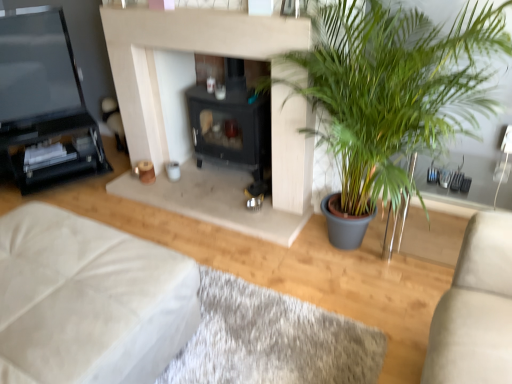
Question: Considering the relative sizes of black matte fireplace at center and green leafy plant at right in the image provided, is black matte fireplace at center shorter than green leafy plant at right?

Choices:
 (A) yes
 (B) no

Answer: (A)

Question: From a real-world perspective, is black matte fireplace at center located beneath green leafy plant at right?

Choices:
 (A) no
 (B) yes

Answer: (B)

Question: Does black matte fireplace at center have a lesser width compared to green leafy plant at right?

Choices:
 (A) yes
 (B) no

Answer: (A)

Question: Considering the relative positions of black matte fireplace at center and green leafy plant at right in the image provided, is black matte fireplace at center to the left of green leafy plant at right from the viewer's perspective?

Choices:
 (A) yes
 (B) no

Answer: (A)

Question: Is black matte fireplace at center further to camera compared to green leafy plant at right?

Choices:
 (A) yes
 (B) no

Answer: (A)

Question: From a real-world perspective, is black matte fireplace at center on green leafy plant at right?

Choices:
 (A) no
 (B) yes

Answer: (A)

Question: Is matte black tv at left oriented away from white fabric at lower left?

Choices:
 (A) no
 (B) yes

Answer: (A)

Question: Is matte black tv at left bigger than white fabric at lower left?

Choices:
 (A) no
 (B) yes

Answer: (B)

Question: From a real-world perspective, is matte black tv at left beneath white fabric at lower left?

Choices:
 (A) no
 (B) yes

Answer: (A)

Question: Is matte black tv at left smaller than white fabric at lower left?

Choices:
 (A) yes
 (B) no

Answer: (B)

Question: Is white fabric at lower left completely or partially inside matte black tv at left?

Choices:
 (A) no
 (B) yes

Answer: (A)

Question: Can you confirm if matte black tv at left is positioned to the right of white fabric at lower left?

Choices:
 (A) no
 (B) yes

Answer: (A)

Question: From a real-world perspective, is black matte fireplace at center physically above white fabric ottoman at lower left?

Choices:
 (A) no
 (B) yes

Answer: (B)